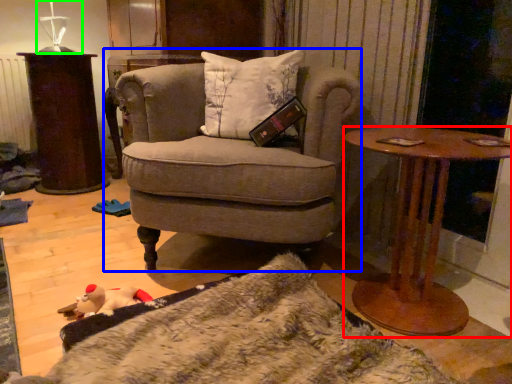
Question: Considering the real-world distances, which object is farthest from desk (highlighted by a red box)? chair (highlighted by a blue box) or table lamp (highlighted by a green box)?

Choices:
 (A) chair
 (B) table lamp

Answer: (B)